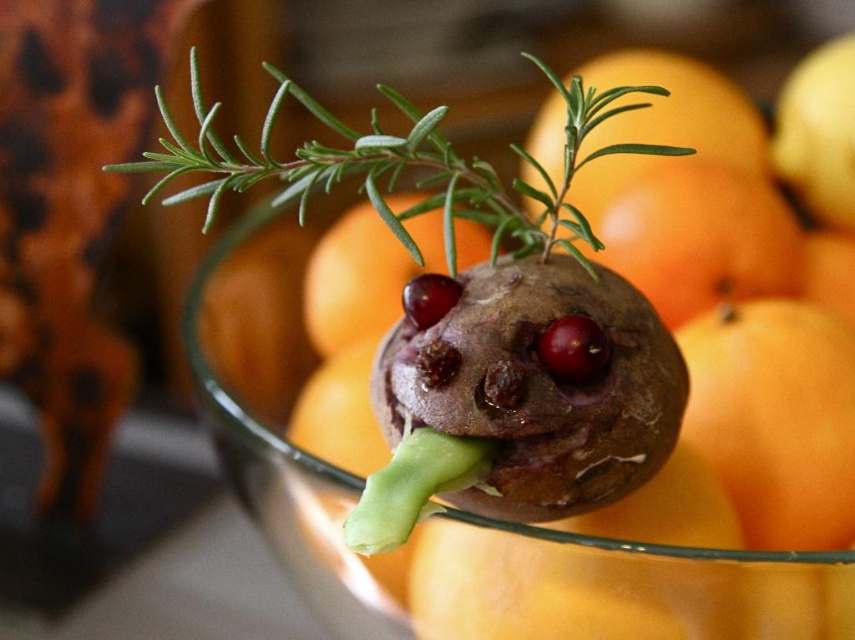
Question: Which object is positioned farthest from the orange matte at upper center?

Choices:
 (A) transparent glass bowl at center
 (B) green leafy rosemary at upper center
 (C) glossy orange at center

Answer: (A)

Question: Can you confirm if transparent glass bowl at center is positioned below orange matte at upper center?

Choices:
 (A) yes
 (B) no

Answer: (A)

Question: From the image, what is the correct spatial relationship of transparent glass bowl at center in relation to green leafy rosemary at upper center?

Choices:
 (A) below
 (B) above

Answer: (A)

Question: Which point is farther to the camera?

Choices:
 (A) transparent glass bowl at center
 (B) shiny red cherry at center
 (C) green leafy rosemary at upper center

Answer: (B)

Question: Can you confirm if transparent glass bowl at center is bigger than green leafy rosemary at upper center?

Choices:
 (A) no
 (B) yes

Answer: (A)

Question: Which object is positioned farthest from the glossy orange at center?

Choices:
 (A) green leafy rosemary at upper center
 (B) transparent glass bowl at center

Answer: (B)